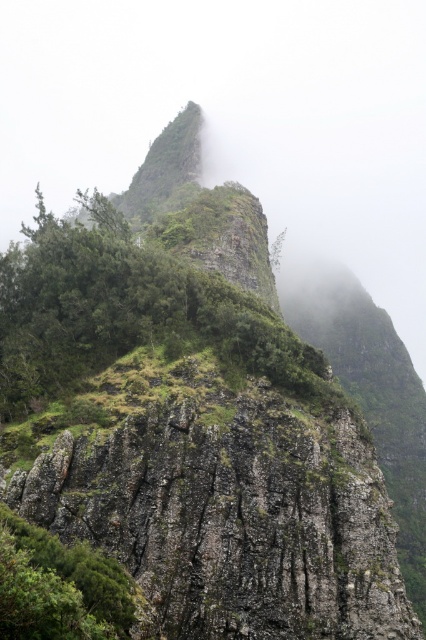
You are a hiker planning to traverse from the green leafy shrub at lower left to the green leafy shrubs at center. Based on the distance between them, can you estimate how long it would take to walk this path if you walk at a steady pace of 3 meters per minute?

The distance between the green leafy shrub at lower left and the green leafy shrubs at center is 15.51 meters. At a pace of 3 meters per minute, it would take approximately 5.17 minutes, which rounds to about 5 minutes and 10 seconds.

You are a hiker trying to navigate through the mountain path. You see green leafy shrubs at center and green leafy shrub at lower left. Which shrub is higher up the mountain?

The green leafy shrubs at center is located above the green leafy shrub at lower left, so the shrub higher up the mountain is the green leafy shrubs at center.